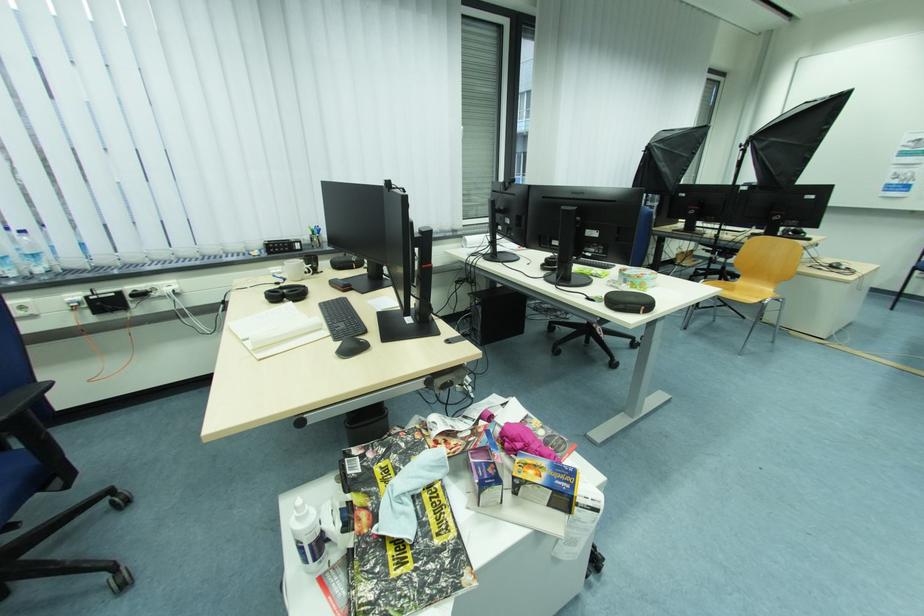
This screenshot has width=924, height=616. What do you see at coordinates (27, 400) in the screenshot?
I see `a blue chair armrest` at bounding box center [27, 400].